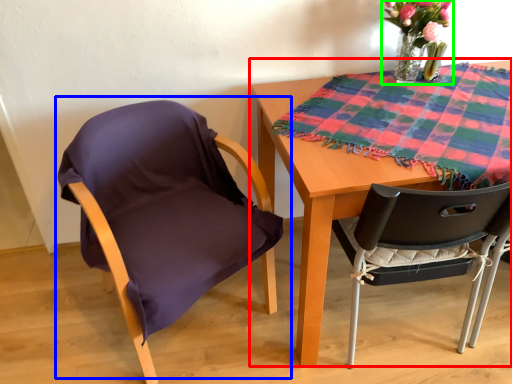
Question: Considering the real-world distances, which object is farthest from table (highlighted by a red box)? chair (highlighted by a blue box) or floral arrangement (highlighted by a green box)?

Choices:
 (A) chair
 (B) floral arrangement

Answer: (B)